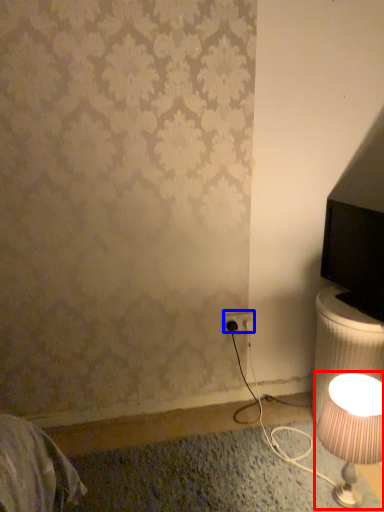
Question: Among these objects, which one is farthest to the camera, lamp (highlighted by a red box) or electric outlet (highlighted by a blue box)?

Choices:
 (A) lamp
 (B) electric outlet

Answer: (B)